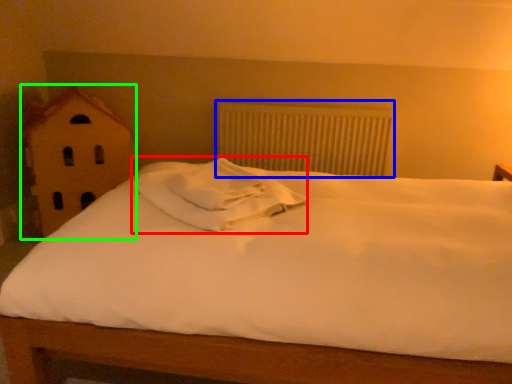
Question: Based on their relative distances, which object is farther from pillow (highlighted by a red box)? Choose from radiator (highlighted by a blue box) and toy (highlighted by a green box).

Choices:
 (A) radiator
 (B) toy

Answer: (A)